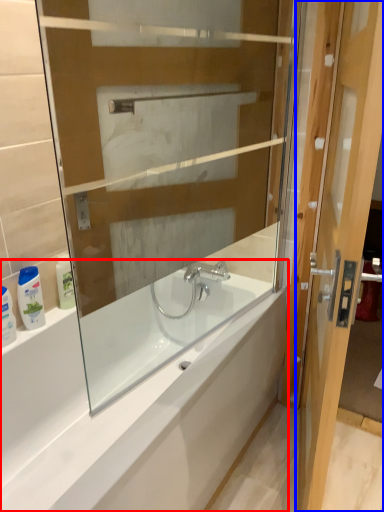
Question: Among these objects, which one is nearest to the camera, bathtub (highlighted by a red box) or door (highlighted by a blue box)?

Choices:
 (A) bathtub
 (B) door

Answer: (B)